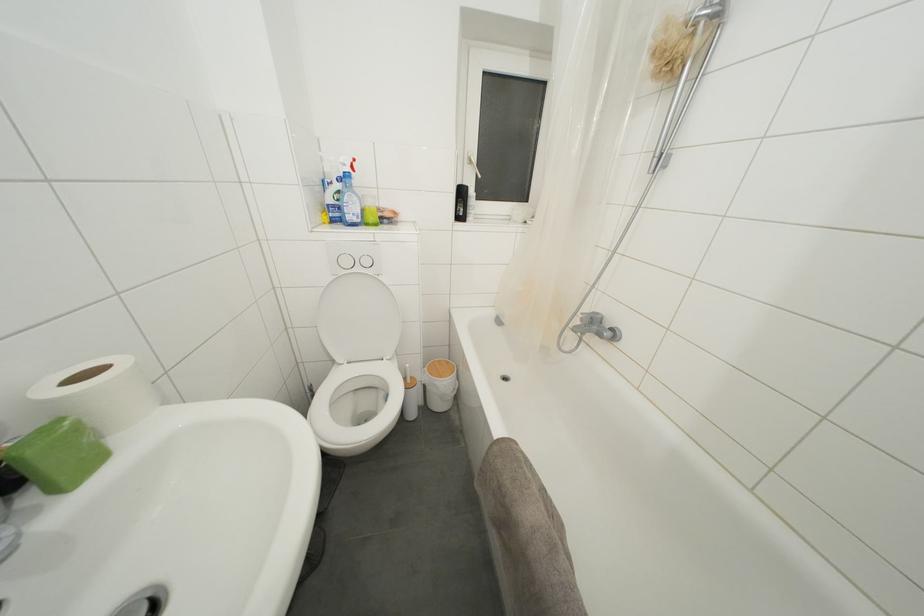
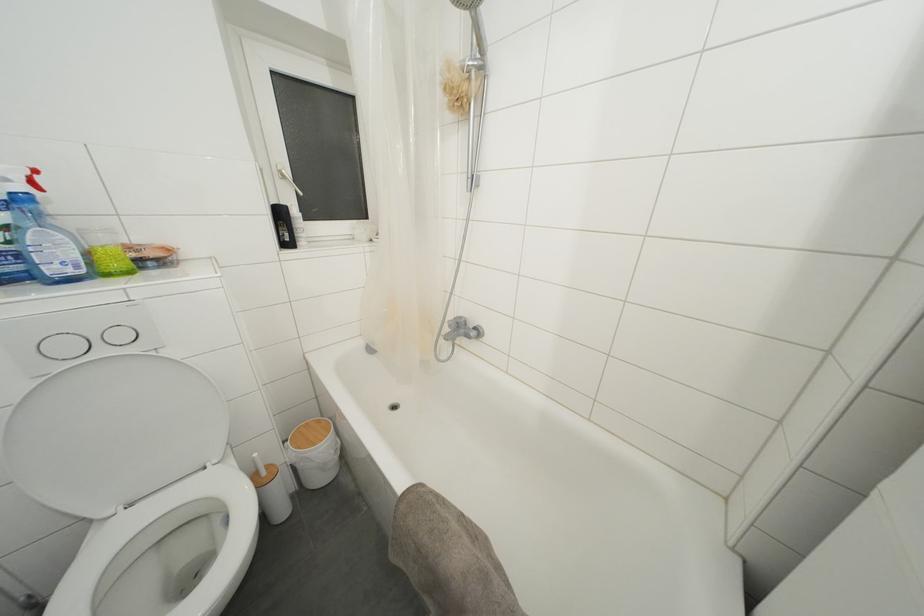
Where in the second image is the point corresponding to (350,267) from the first image?

(71, 352)